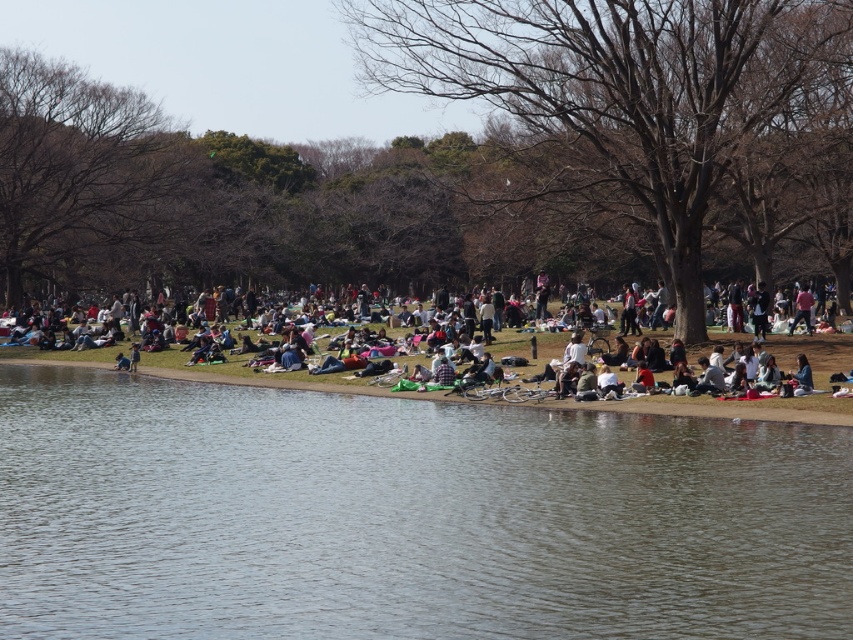
Which of these two, clear water at lower center or light brown fabric picnic blanket at center, stands taller?

With more height is light brown fabric picnic blanket at center.

Can you confirm if clear water at lower center is positioned above light brown fabric picnic blanket at center?

No, clear water at lower center is not above light brown fabric picnic blanket at center.

The image size is (853, 640). Identify the location of clear water at lower center. (405, 516).